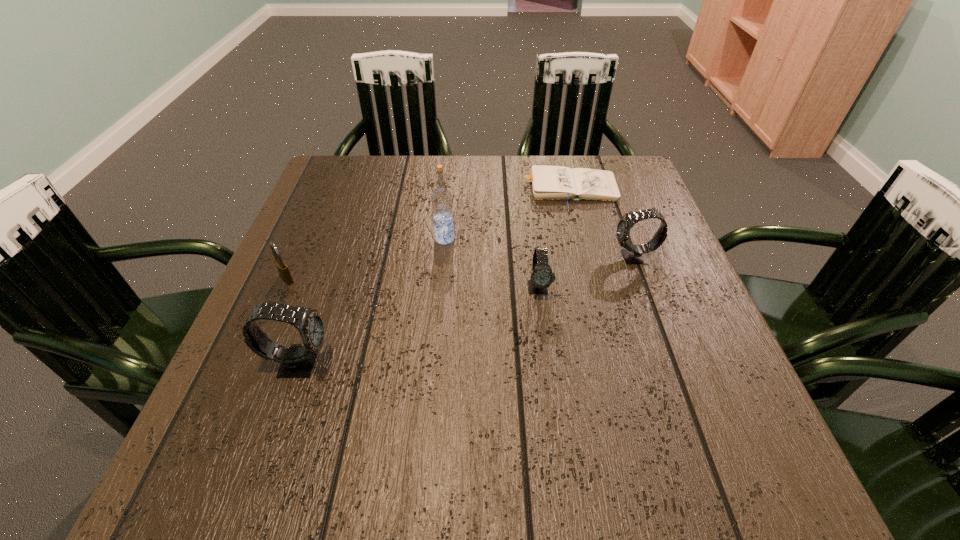
Where is `the second tallest object`? This screenshot has height=540, width=960. the second tallest object is located at coordinates (297, 361).

In order to click on the nearest object in this screenshot , I will do `click(297, 361)`.

What are the coordinates of `the second watch from right to left` in the screenshot? It's located at pos(541,278).

Where is `the shortest watch`? Image resolution: width=960 pixels, height=540 pixels. the shortest watch is located at coordinates tap(541, 278).

The image size is (960, 540). I want to click on the third farthest object, so click(x=633, y=254).

Find the location of a particular element. The height and width of the screenshot is (540, 960). the second shortest watch is located at coordinates (633, 254).

I want to click on the shortest object, so click(548, 182).

Locate an element on the screen. Image resolution: width=960 pixels, height=540 pixels. the farthest object is located at coordinates (548, 182).

I want to click on the leftmost object, so click(x=281, y=265).

Identify the location of the tallest object. (441, 199).